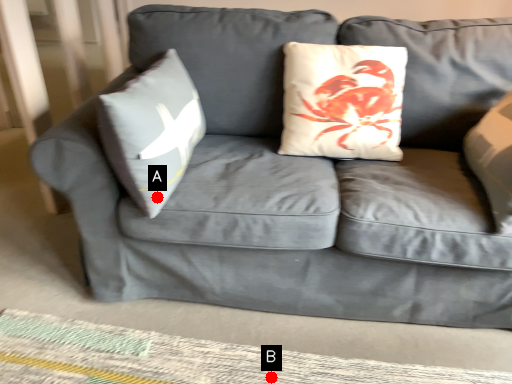
Question: Two points are circled on the image, labeled by A and B beside each circle. Which point is closer to the camera taking this photo?

Choices:
 (A) A is closer
 (B) B is closer

Answer: (A)